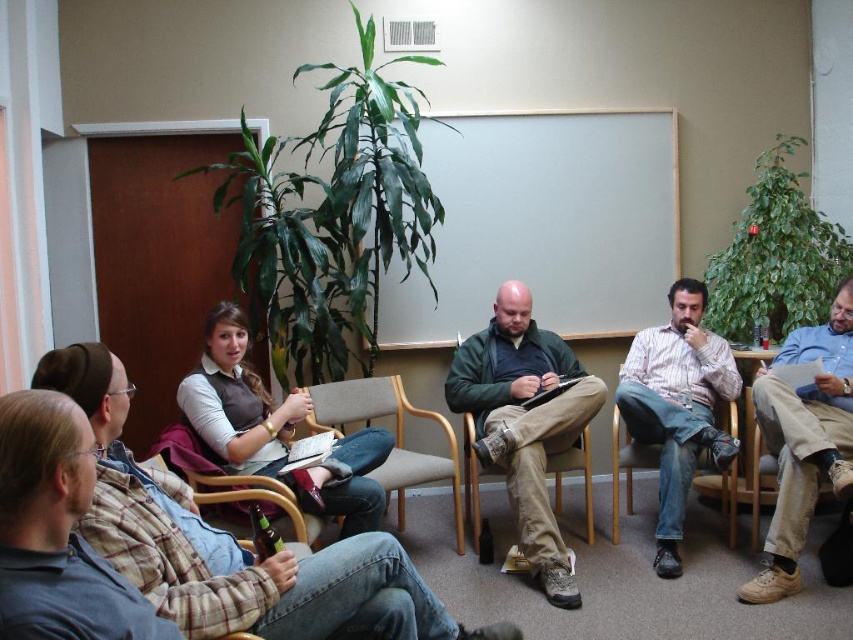
You are sitting in the light brown wood armchair at center and want to hand a document to the person wearing the green matte jacket at center. In which direction should you pass the document?

You should pass the document to your right since the green matte jacket at center is to the right of the light brown wood armchair at center.

You are attending a meeting and need to sit down. You see the green matte jacket at center and the light brown wood armchair at center. Which object is closer to you?

The green matte jacket at center is closer to you because it is in front of the light brown wood armchair at center.